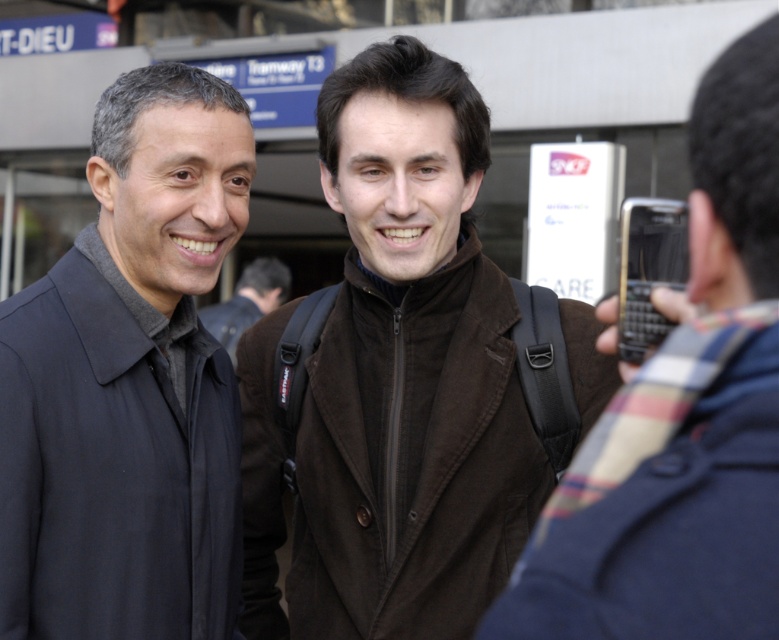
You are taking a photo of the two people in the scene. The black plastic phone at right is at point (647, 269). Where should you position your camera to ensure both individuals are fully visible in the frame?

Position the camera so that it captures the entire area around the two individuals, ensuring the black plastic phone at right at point (647, 269) is within the frame along with both people.

You are a tailor who needs to determine which coat requires more fabric to repair. Based on the image, which one would need more fabric, the brown woolen coat at center or the matte black jacket at left?

The brown woolen coat at center requires more fabric for repair since it is larger than the matte black jacket at left.